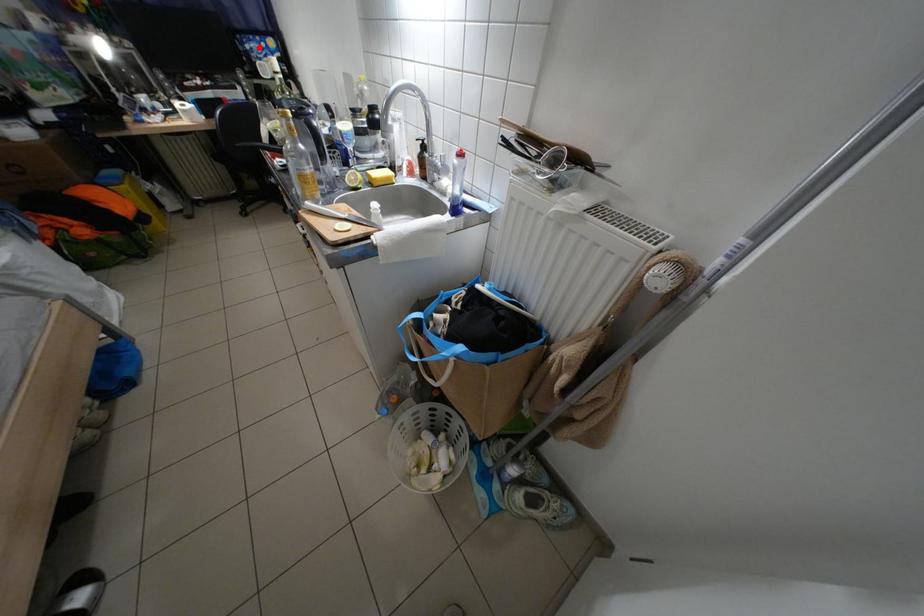
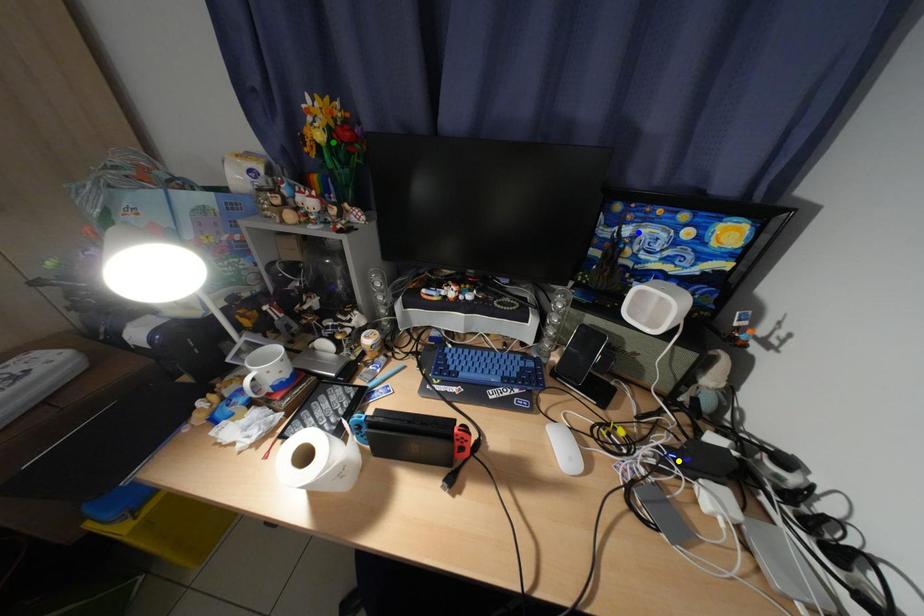
Question: I am providing you with two images of the same scene from different viewpoints. A red point is marked on the first image. You are given multiple points on the second image. Which point in image 2 represents the same 3d spot as the red point in image 1?

Choices:
 (A) yellow point
 (B) green point
 (C) blue point

Answer: (C)